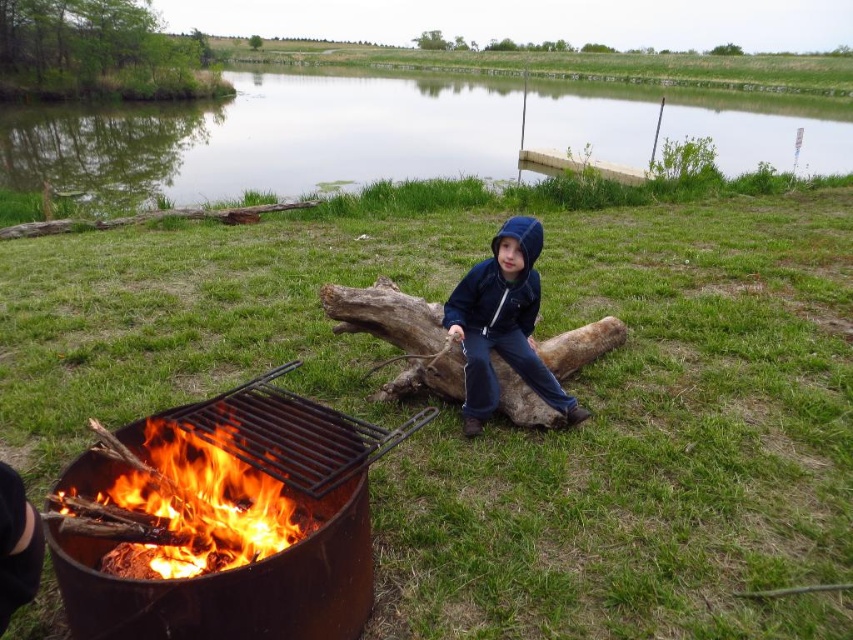
Question: Does green grassy lake at upper center appear on the left side of flaming wood at lower left?

Choices:
 (A) yes
 (B) no

Answer: (A)

Question: Which object appears farthest from the camera in this image?

Choices:
 (A) blue fleece jacket at center
 (B) brown rough wood log at center
 (C) green grassy lake at upper center

Answer: (C)

Question: Is green grassy lake at upper center positioned behind rusty metal fire pit at lower left?

Choices:
 (A) yes
 (B) no

Answer: (A)

Question: Which point is closer to the camera?

Choices:
 (A) 540,413
 (B) 187,552
 (C) 614,128
 (D) 132,579

Answer: (D)

Question: Can you confirm if green grassy lake at upper center is positioned above brown rough wood log at center?

Choices:
 (A) yes
 (B) no

Answer: (A)

Question: Estimate the real-world distances between objects in this image. Which object is closer to the flaming wood at lower left?

Choices:
 (A) green grassy lake at upper center
 (B) brown rough wood log at center
 (C) rusty metal fire pit at lower left
 (D) blue fleece jacket at center

Answer: (C)